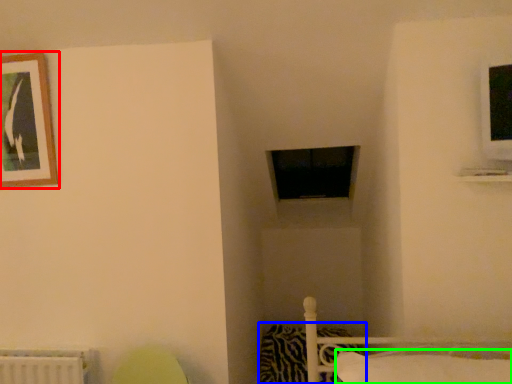
Question: Which is nearer to the picture frame (highlighted by a red box)? pillow (highlighted by a blue box) or pillow (highlighted by a green box).

Choices:
 (A) pillow
 (B) pillow

Answer: (B)